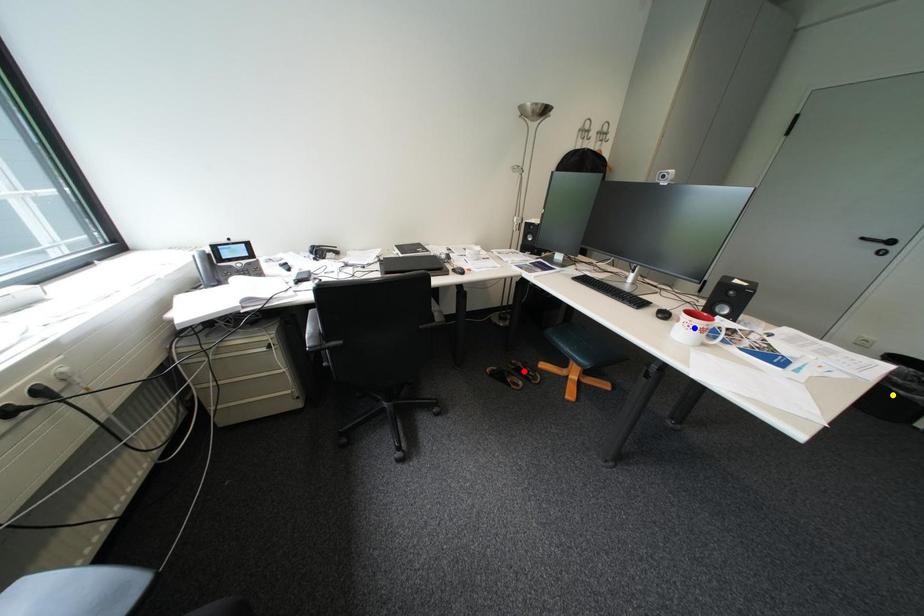
Order these from nearest to farthest:
1. red point
2. blue point
3. yellow point

1. blue point
2. yellow point
3. red point